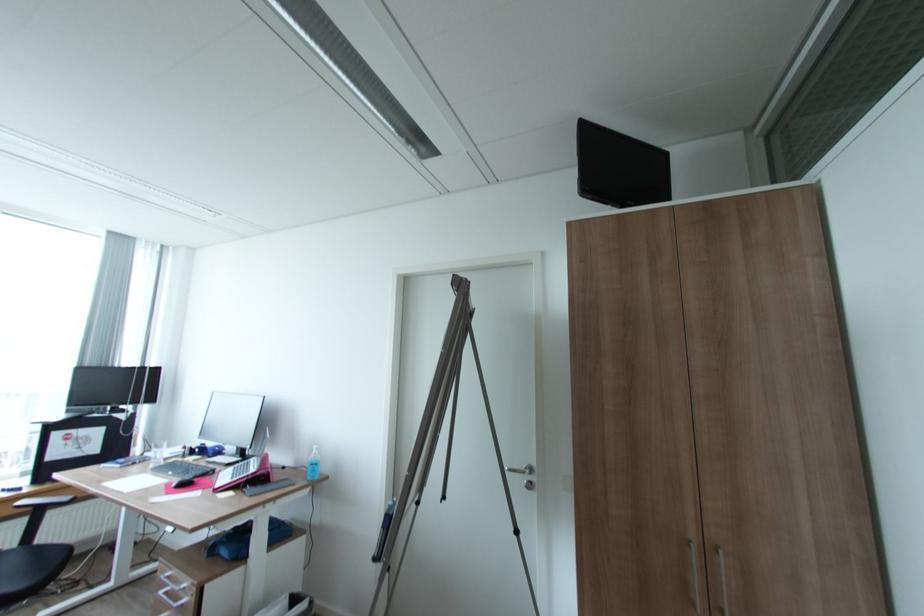
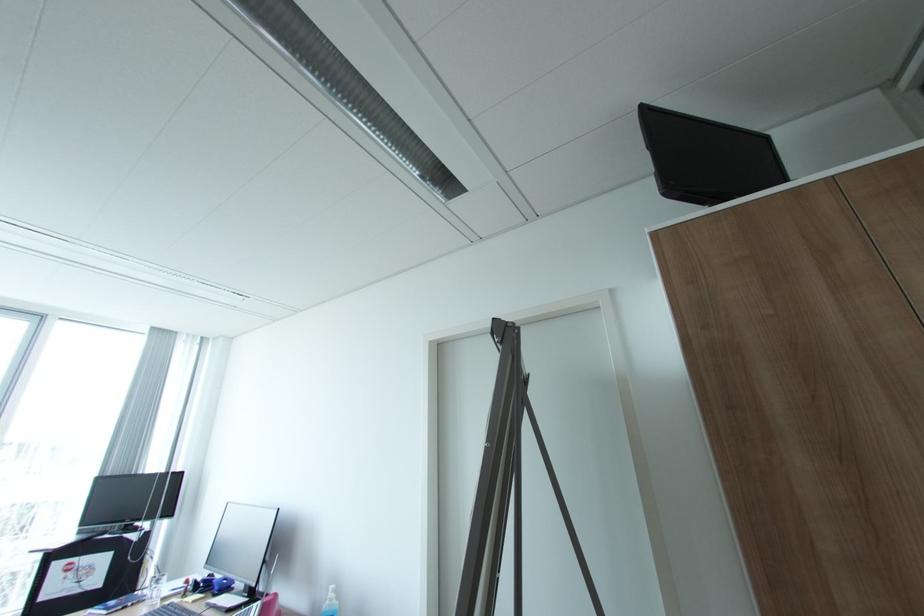
Where in the second image is the point corresponding to pixel 320 454 from the first image?

(336, 599)